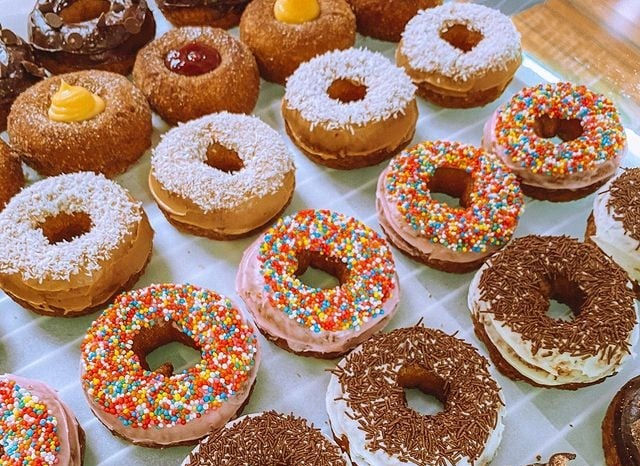
Where is `white cooking paper`? The width and height of the screenshot is (640, 466). white cooking paper is located at coordinates (548, 425), (442, 304), (330, 172), (188, 256), (13, 351), (283, 380), (553, 217), (451, 119).